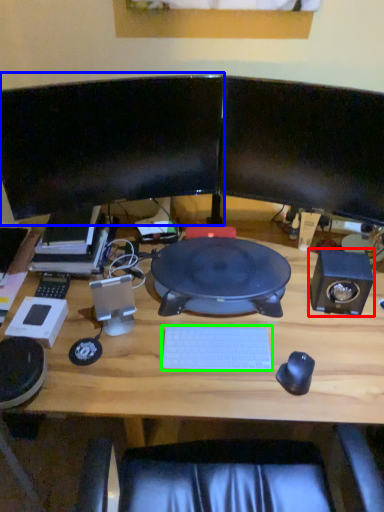
Question: Which object is the farthest from speaker (highlighted by a red box)? Choose among these: computer monitor (highlighted by a blue box) or computer keyboard (highlighted by a green box).

Choices:
 (A) computer monitor
 (B) computer keyboard

Answer: (A)